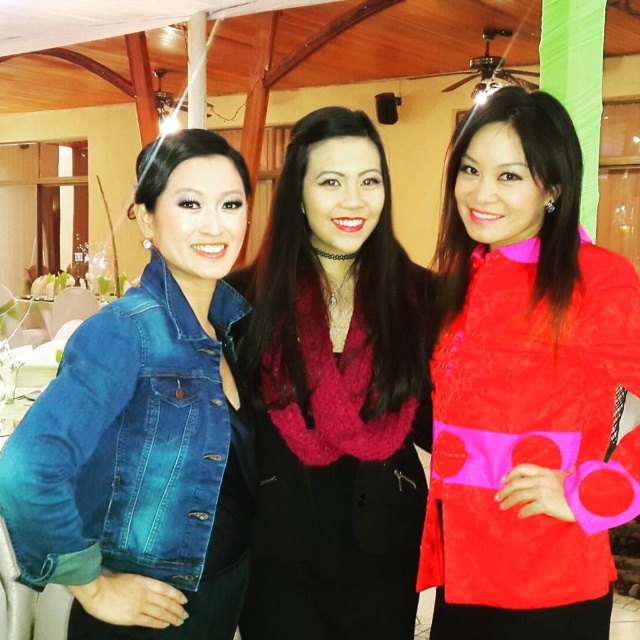
You are a fashion designer observing the three women at the event. You need to determine which item of clothing is wider between the denim jacket at left and the velvet red scarf at center. Based on the scene, which one is wider?

The velvet red scarf at center is wider than the denim jacket at left.

Consider the image. You are taking a photo of the three women in the scene. You want to focus on the woman at point (552,276) and the woman at point (289,356). Which of these two points is closer to the camera?

Point (552,276) is closer to the camera than point (289,356).

You are at a social event in a restaurant with wooden beams and tables. You see two points marked in the image. The first point is at coordinates point (180, 554) and the second is at point (333, 193). Which point is closer to you?

Point (180, 554) is in front of point (333, 193), so the first point is closer to you.